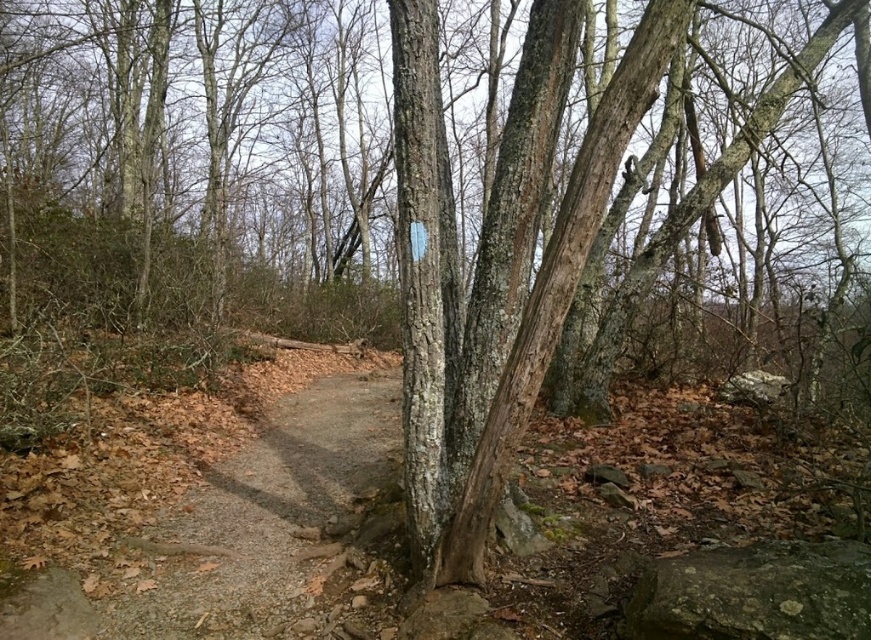
Which of these two, smooth bark tree at center or gray rough rock at lower right, stands shorter?

gray rough rock at lower right

Does point (408, 180) come farther from viewer compared to point (780, 561)?

Yes, point (408, 180) is behind point (780, 561).

Does point (552, 280) come closer to viewer compared to point (680, 621)?

No.

This screenshot has width=871, height=640. What are the coordinates of `smooth bark tree at center` in the screenshot? It's located at click(x=504, y=268).

Is dirt/gravel path at center closer to camera compared to gray rough rock at lower right?

No, dirt/gravel path at center is further to the viewer.

Is point (376, 372) farther from viewer compared to point (724, 573)?

Yes, it is.

Where is `dirt/gravel path at center`? The image size is (871, 640). dirt/gravel path at center is located at coordinates [x=261, y=516].

In the scene shown: Is smooth bark tree at center to the left of dirt/gravel path at center from the viewer's perspective?

Incorrect, smooth bark tree at center is not on the left side of dirt/gravel path at center.

Image resolution: width=871 pixels, height=640 pixels. In order to click on smooth bark tree at center in this screenshot , I will do `click(504, 268)`.